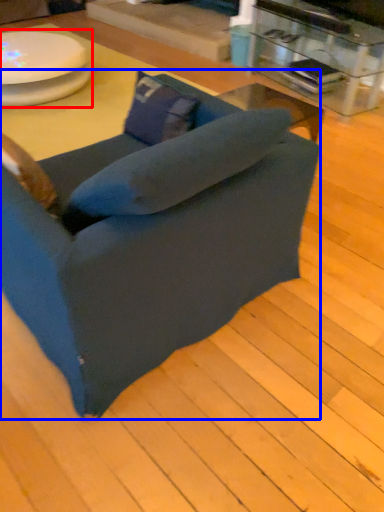
Question: Which object is further to the camera taking this photo, round table (highlighted by a red box) or chair (highlighted by a blue box)?

Choices:
 (A) round table
 (B) chair

Answer: (A)